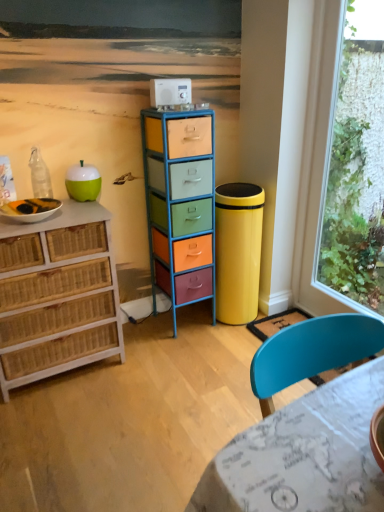
At what (x,y) coordinates should I click in order to perform the action: click on free space in front of woven wood chest of drawers at left, placed as the 2th chest of drawers when sorted from right to left. Please return your answer as a coordinate pair (x, y). The width and height of the screenshot is (384, 512). Looking at the image, I should click on (62, 428).